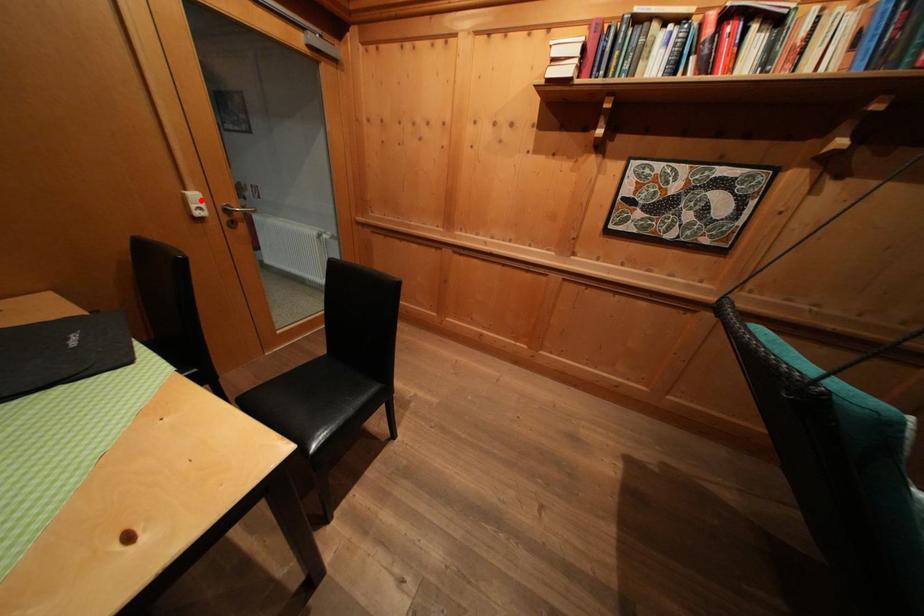
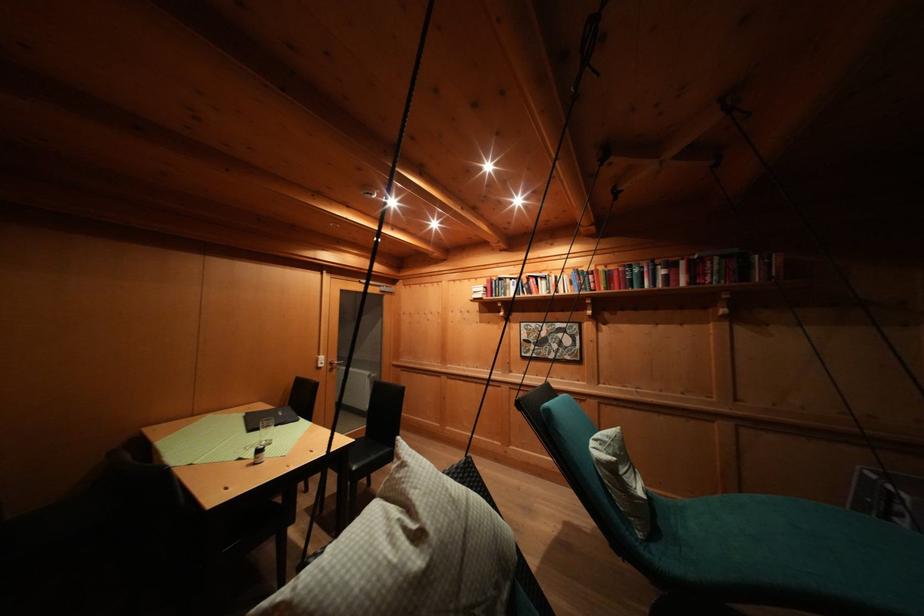
Locate, in the second image, the point that corresponds to the highlighted location in the first image.

(327, 362)